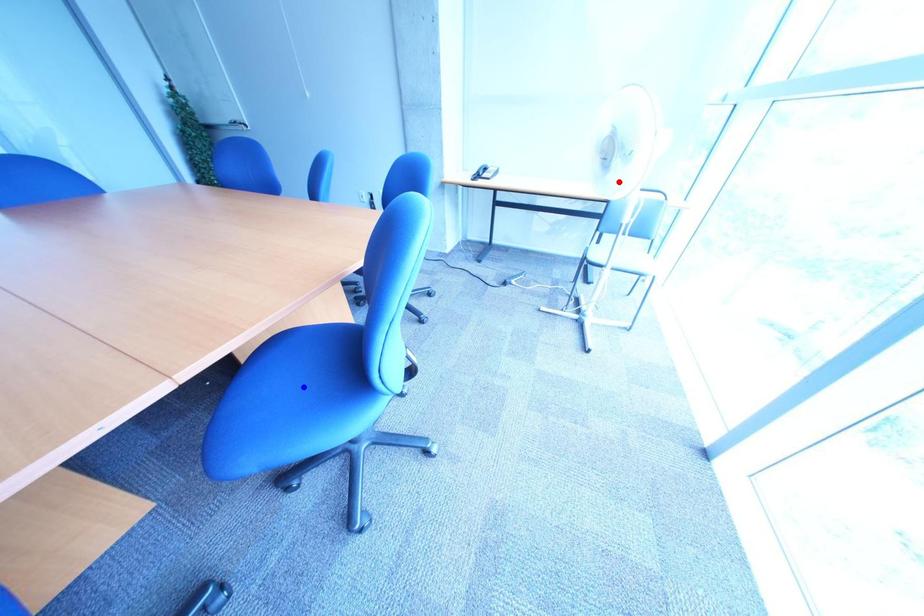
Question: Two points are marked on the image. Which point is closer to the camera?

Choices:
 (A) Blue point is closer.
 (B) Red point is closer.

Answer: (A)